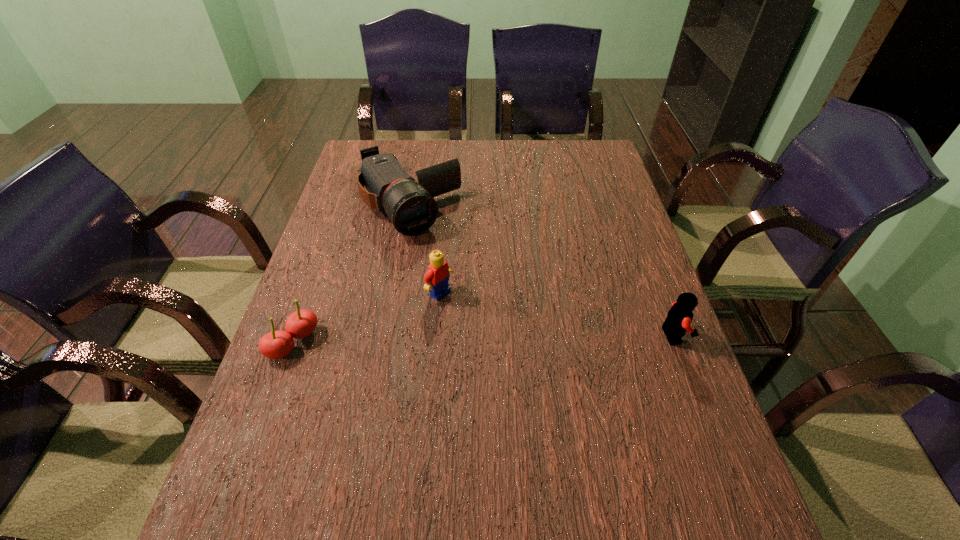
Locate an element on the screen. This screenshot has width=960, height=540. vacant space on the desktop that is between the shortest object and the rightmost object and is positioned on the lens of the camcorder is located at coordinates (510, 338).

In order to click on vacant space on the desktop that is between the cherry and the nearer Lego and is positioned on the face of the left Lego in this screenshot , I will do `click(504, 338)`.